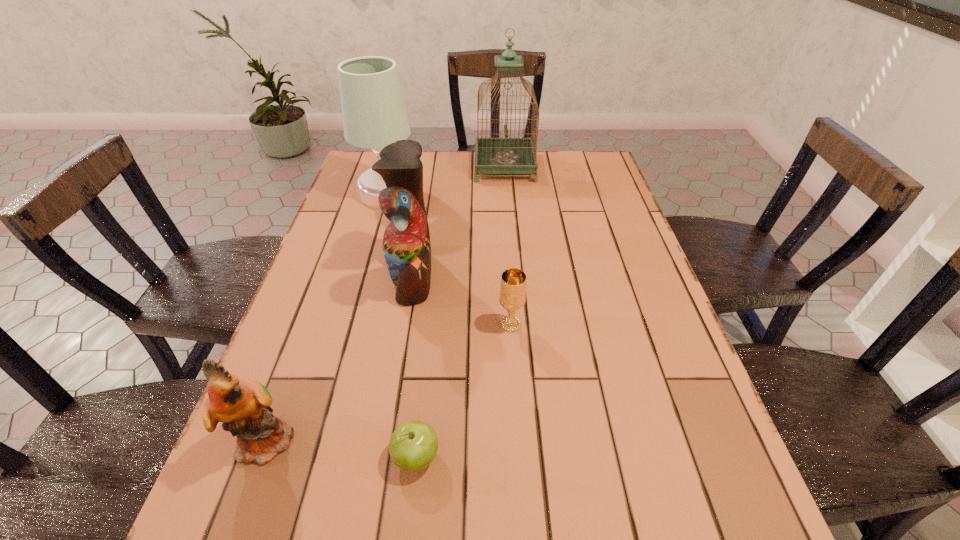
Locate an element on the screen. The height and width of the screenshot is (540, 960). birdcage is located at coordinates (506, 155).

Find the location of a particular element. lampshade is located at coordinates (374, 115).

You are a GUI agent. You are given a task and a screenshot of the screen. Output one action in this format:
    pyautogui.click(x=<x>, y=<y>)
    Task: Click on the farther parrot
    This screenshot has height=540, width=960.
    Given the screenshot: What is the action you would take?
    pyautogui.click(x=406, y=243)

The image size is (960, 540). Identify the location of the fourth nearest object. (406, 243).

Identify the location of the left parrot. The height and width of the screenshot is (540, 960). (243, 406).

You are a GUI agent. You are given a task and a screenshot of the screen. Output one action in this format:
    pyautogui.click(x=<x>, y=<y>)
    Task: Click on the shorter parrot
    
    Given the screenshot: What is the action you would take?
    pyautogui.click(x=243, y=406)

Locate an element on the screen. The height and width of the screenshot is (540, 960). chalice is located at coordinates click(x=512, y=296).

Where is `the third nearest object`? The image size is (960, 540). the third nearest object is located at coordinates (512, 296).

Where is `the shortest object`? The image size is (960, 540). the shortest object is located at coordinates (413, 446).

You are a GUI agent. You are given a task and a screenshot of the screen. Output one action in this format:
    pyautogui.click(x=<x>, y=<y>)
    Task: Click on the free spot located 0.090m at the door of the birdcage
    This screenshot has height=540, width=960.
    Given the screenshot: What is the action you would take?
    tap(448, 167)